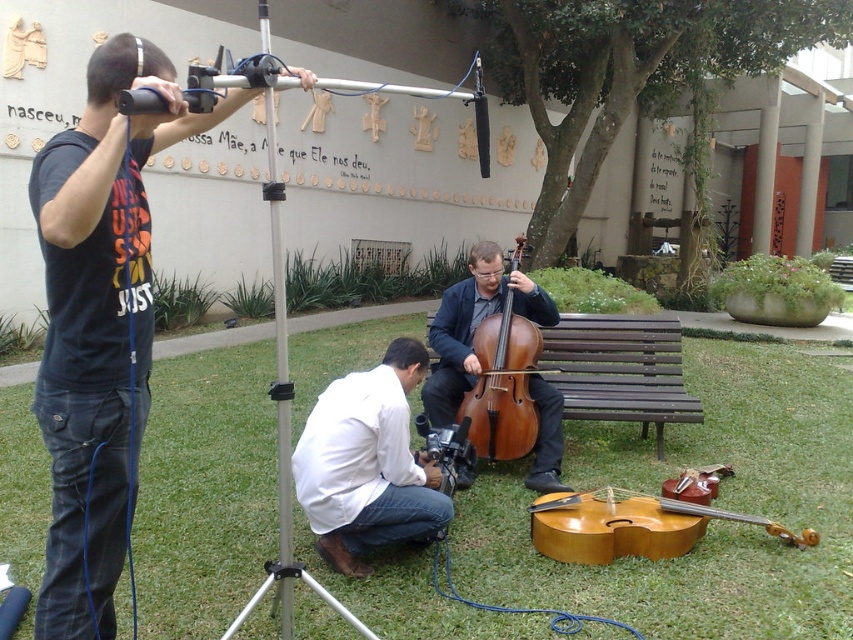
Question: Can you confirm if dark blue t-shirt at left is positioned to the left of light brown wooden violin at lower center?

Choices:
 (A) no
 (B) yes

Answer: (B)

Question: Which object is positioned closest to the white cotton shirt at center?

Choices:
 (A) silver metallic tripod at center
 (B) light brown wooden violin at lower center

Answer: (B)

Question: Is white cotton shirt at center closer to the viewer compared to light brown wooden violin at lower center?

Choices:
 (A) no
 (B) yes

Answer: (B)

Question: Which point is closer to the camera?

Choices:
 (A) (289, 410)
 (B) (639, 513)
 (C) (659, 400)

Answer: (A)

Question: Is white cotton shirt at center above silver metallic tripod at center?

Choices:
 (A) no
 (B) yes

Answer: (A)

Question: Which point is farther from the camera taking this photo?

Choices:
 (A) (154, 70)
 (B) (592, 353)
 (C) (294, 477)

Answer: (B)